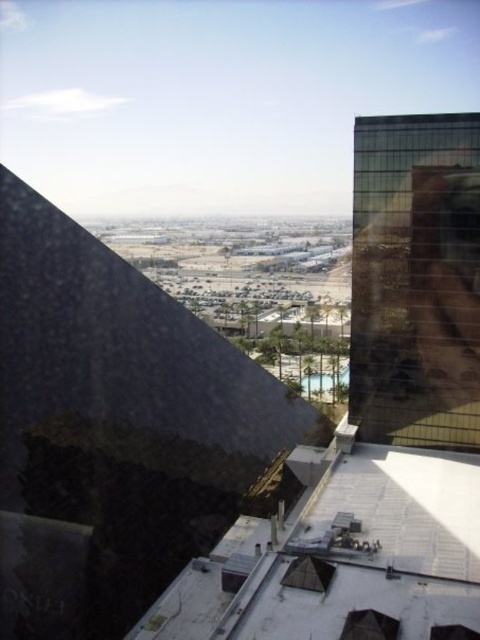
Question: Among these points, which one is farthest from the camera?

Choices:
 (A) (409, 333)
 (B) (372, 627)
 (C) (197, 438)

Answer: (C)

Question: Is matte glass pyramid at center smaller than transparent glass window at center?

Choices:
 (A) no
 (B) yes

Answer: (A)

Question: Does green reflective glass building at right appear on the left side of matte glass pyramid at center?

Choices:
 (A) no
 (B) yes

Answer: (A)

Question: Among these objects, which one is nearest to the camera?

Choices:
 (A) dark granite pyramid at center
 (B) transparent glass window at center
 (C) green reflective glass building at right

Answer: (B)

Question: Is matte glass pyramid at center positioned behind transparent glass window at center?

Choices:
 (A) no
 (B) yes

Answer: (B)

Question: Which point is closer to the camera?

Choices:
 (A) (152, 358)
 (B) (384, 625)

Answer: (B)